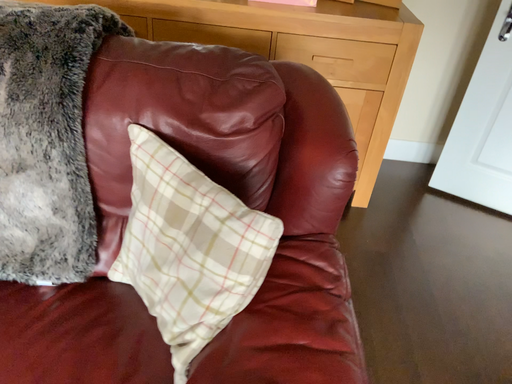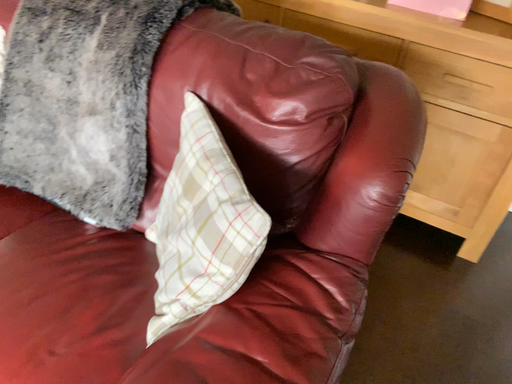
Question: Which way did the camera rotate in the video?

Choices:
 (A) rotated left
 (B) rotated right

Answer: (A)